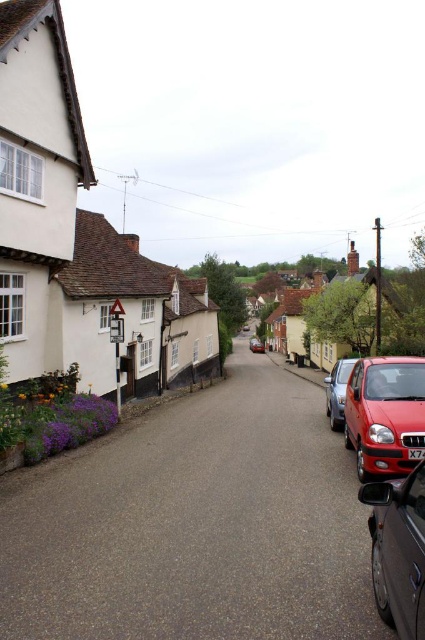
Question: Which is nearer to the metallic silver car at right?

Choices:
 (A) shiny red car at right
 (B) shiny silver car at lower right

Answer: (A)

Question: Does shiny red car at right have a larger size compared to black plastic license plate at center?

Choices:
 (A) no
 (B) yes

Answer: (B)

Question: Which of the following is the closest to the observer?

Choices:
 (A) (357, 394)
 (B) (345, 385)

Answer: (A)

Question: Is the position of shiny silver car at lower right more distant than that of metallic silver car at center?

Choices:
 (A) no
 (B) yes

Answer: (A)

Question: Is shiny red car at right closer to the viewer compared to metallic silver car at right?

Choices:
 (A) yes
 (B) no

Answer: (A)

Question: Which of the following is the farthest from the observer?

Choices:
 (A) (255, 340)
 (B) (328, 413)

Answer: (A)